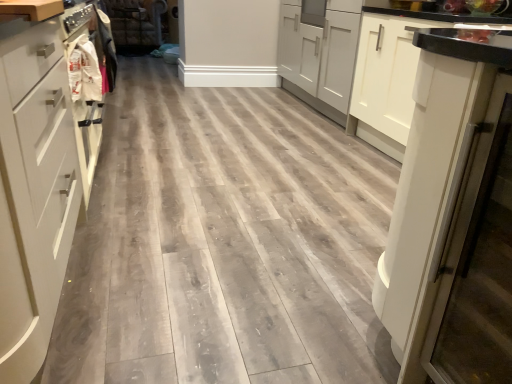
What are the coordinates of `white matte cabinet at right, the second cabinetry viewed from the left` in the screenshot? It's located at (356, 68).

The height and width of the screenshot is (384, 512). What do you see at coordinates (106, 47) in the screenshot? I see `white fabric laundry at left` at bounding box center [106, 47].

This screenshot has width=512, height=384. I want to click on white fabric bag at left, so click(84, 70).

You are a GUI agent. You are given a task and a screenshot of the screen. Output one action in this format:
    pyautogui.click(x=<x>, y=<y>)
    Task: Click on the faux leather couch at upper center
    Image resolution: width=512 pixels, height=384 pixels.
    Given the screenshot: What is the action you would take?
    pyautogui.click(x=136, y=21)

Which is in front, white matte cabinet at left, which is counted as the first cabinetry, starting from the left, or white glossy refrigerator at right?

white matte cabinet at left, which is counted as the first cabinetry, starting from the left, is in front.

From a real-world perspective, is white matte cabinet at left, placed as the second cabinetry when sorted from back to front, positioned under white glossy refrigerator at right based on gravity?

Incorrect, from a real-world perspective, white matte cabinet at left, placed as the second cabinetry when sorted from back to front, is higher than white glossy refrigerator at right.

Who is bigger, white matte cabinet at left, the first cabinetry viewed from the front, or white glossy refrigerator at right?

Bigger between the two is white matte cabinet at left, the first cabinetry viewed from the front.

Does white matte cabinet at left, which is counted as the first cabinetry, starting from the left, turn towards white glossy refrigerator at right?

Yes, white matte cabinet at left, which is counted as the first cabinetry, starting from the left, faces towards white glossy refrigerator at right.

Is white fabric laundry at left at the left side of white matte cabinet at left, the second cabinetry when ordered from right to left?

Indeed, white fabric laundry at left is positioned on the left side of white matte cabinet at left, the second cabinetry when ordered from right to left.

I want to click on cabinetry that is the 2nd one when counting forward from the white fabric laundry at left, so click(34, 183).

From the image's perspective, does white fabric laundry at left appear lower than white matte cabinet at left, which is counted as the first cabinetry, starting from the left?

Incorrect, from the image's perspective, white fabric laundry at left is higher than white matte cabinet at left, which is counted as the first cabinetry, starting from the left.

Is faux leather couch at upper center not within white glossy refrigerator at right?

Yes, faux leather couch at upper center is located beyond the bounds of white glossy refrigerator at right.

Which object is further away from the camera taking this photo, faux leather couch at upper center or white glossy refrigerator at right?

faux leather couch at upper center.

From a real-world perspective, is faux leather couch at upper center physically above white glossy refrigerator at right?

No.

Which of these two, faux leather couch at upper center or white glossy refrigerator at right, is smaller?

Smaller between the two is white glossy refrigerator at right.

From the picture: Is faux leather couch at upper center positioned with its back to white fabric laundry at left?

faux leather couch at upper center is not turned away from white fabric laundry at left.

Is faux leather couch at upper center positioned beyond the bounds of white fabric laundry at left?

Yes, faux leather couch at upper center is not within white fabric laundry at left.

Considering the relative positions of faux leather couch at upper center and white fabric laundry at left in the image provided, is faux leather couch at upper center to the left or to the right of white fabric laundry at left?

faux leather couch at upper center is positioned on white fabric laundry at left's left side.

Is white fabric laundry at left closer to the viewer compared to faux leather couch at upper center?

Yes, the depth of white fabric laundry at left is less than that of faux leather couch at upper center.

Does point (113, 70) come in front of point (161, 43)?

Yes, it is in front of point (161, 43).

Looking at this image, is white fabric laundry at left taller than faux leather couch at upper center?

No.

Can you confirm if white fabric laundry at left is smaller than faux leather couch at upper center?

Yes, white fabric laundry at left is smaller than faux leather couch at upper center.

Consider the image. In terms of width, does white fabric bag at left look wider or thinner when compared to white matte cabinet at left, the first cabinetry viewed from the front?

Considering their sizes, white fabric bag at left looks slimmer than white matte cabinet at left, the first cabinetry viewed from the front.

Is white fabric bag at left inside or outside of white matte cabinet at left, which is counted as the first cabinetry, starting from the left?

The correct answer is: outside.

Can you confirm if white fabric bag at left is shorter than white matte cabinet at left, the second cabinetry when ordered from right to left?

Indeed, white fabric bag at left has a lesser height compared to white matte cabinet at left, the second cabinetry when ordered from right to left.

From a real-world perspective, is white matte cabinet at left, which is counted as the first cabinetry, starting from the left, beneath white matte drawer at left?

No, from a real-world perspective, white matte cabinet at left, which is counted as the first cabinetry, starting from the left, is not below white matte drawer at left.

Considering the relative sizes of white matte cabinet at left, the second cabinetry when ordered from right to left, and white matte drawer at left in the image provided, is white matte cabinet at left, the second cabinetry when ordered from right to left, taller than white matte drawer at left?

Correct, white matte cabinet at left, the second cabinetry when ordered from right to left, is much taller as white matte drawer at left.

The width and height of the screenshot is (512, 384). There is a white matte drawer at left. Identify the location of the 1st cabinetry above it (from a real-world perspective). (34, 183).

Find the location of a particular element. appliance located underneath the white matte cabinet at left, the first cabinetry viewed from the front (from a real-world perspective) is located at coordinates (478, 262).

You are a GUI agent. You are given a task and a screenshot of the screen. Output one action in this format:
    pyautogui.click(x=<x>, y=<y>)
    Task: Click on the laundry above the white matte cabinet at left, the second cabinetry when ordered from right to left (from the image's perspective)
    
    Given the screenshot: What is the action you would take?
    pyautogui.click(x=106, y=47)

Which object lies further to the anchor point white fabric bag at left, white matte drawer at left or white glossy refrigerator at right?

Among the two, white glossy refrigerator at right is located further to white fabric bag at left.

Based on their spatial positions, is white fabric laundry at left or white fabric bag at left further from white glossy refrigerator at right?

white fabric laundry at left.

Looking at the image, which one is located closer to white matte drawer at left, white fabric bag at left or faux leather couch at upper center?

Among the two, white fabric bag at left is located nearer to white matte drawer at left.

Based on their spatial positions, is white fabric laundry at left or white matte cabinet at right, the second cabinetry viewed from the left, closer to faux leather couch at upper center?

Based on the image, white fabric laundry at left appears to be nearer to faux leather couch at upper center.

When comparing their distances from faux leather couch at upper center, does white fabric bag at left or white glossy refrigerator at right seem closer?

Among the two, white fabric bag at left is located nearer to faux leather couch at upper center.

In the scene shown: Looking at the image, which one is located closer to white matte drawer at left, white fabric laundry at left or white matte cabinet at right, arranged as the 2th cabinetry when viewed from the front?

The object closer to white matte drawer at left is white matte cabinet at right, arranged as the 2th cabinetry when viewed from the front.

From the image, which object appears to be nearer to white glossy refrigerator at right, white matte cabinet at right, the second cabinetry viewed from the left, or faux leather couch at upper center?

Among the two, white matte cabinet at right, the second cabinetry viewed from the left, is located nearer to white glossy refrigerator at right.

Looking at the image, which one is located closer to white fabric bag at left, white matte cabinet at right, arranged as the 2th cabinetry when viewed from the front, or white matte cabinet at left, which is counted as the first cabinetry, starting from the left?

white matte cabinet at left, which is counted as the first cabinetry, starting from the left, is positioned closer to the anchor white fabric bag at left.

Where is `drawer between white glossy refrigerator at right and white fabric laundry at left along the z-axis`? The image size is (512, 384). drawer between white glossy refrigerator at right and white fabric laundry at left along the z-axis is located at coordinates (48, 142).

I want to click on appliance between white matte drawer at left and white matte cabinet at right, arranged as the 2th cabinetry when viewed from the front, in the horizontal direction, so click(x=478, y=262).

Locate an element on the screen. cabinetry between white glossy refrigerator at right and faux leather couch at upper center in the front-back direction is located at coordinates (356, 68).

Find the location of a particular element. The height and width of the screenshot is (384, 512). laundry between white matte cabinet at right, arranged as the 2th cabinetry when viewed from the front, and faux leather couch at upper center in the front-back direction is located at coordinates (106, 47).